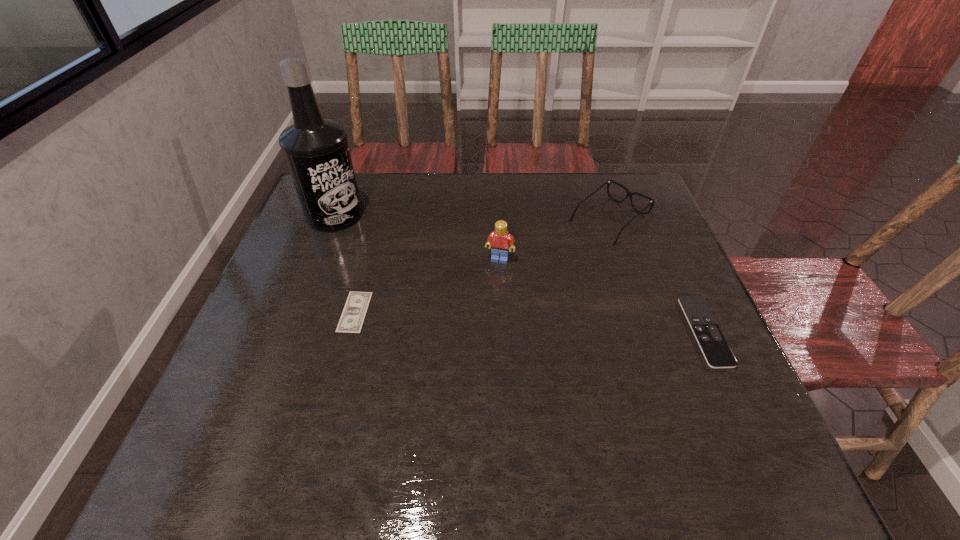
Locate an element on the screen. vacant region located with the lenses facing outward on the spectacles is located at coordinates (493, 307).

Locate an element on the screen. The height and width of the screenshot is (540, 960). vacant area situated with the lenses facing outward on the spectacles is located at coordinates (540, 273).

Find the location of a particular element. free space located with the lenses facing outward on the spectacles is located at coordinates (564, 254).

I want to click on vacant point located on the front label of the liquor, so click(x=400, y=253).

Where is `vacant space located on the front label of the liquor`? vacant space located on the front label of the liquor is located at coordinates (408, 258).

The image size is (960, 540). In order to click on vacant region located 0.050m on the front label of the liquor in this screenshot , I will do `click(366, 233)`.

Locate an element on the screen. The width and height of the screenshot is (960, 540). free space located on the front-facing side of the third object from left to right is located at coordinates (458, 390).

Locate an element on the screen. blank area located 0.400m on the front-facing side of the third object from left to right is located at coordinates (454, 404).

You are a GUI agent. You are given a task and a screenshot of the screen. Output one action in this format:
    pyautogui.click(x=<x>, y=<y>)
    Task: Click on the vacant position located 0.270m on the front-facing side of the third object from left to right
    The height and width of the screenshot is (540, 960).
    Given the screenshot: What is the action you would take?
    pyautogui.click(x=470, y=349)

Image resolution: width=960 pixels, height=540 pixels. Identify the location of spectacles that is at the far edge. (629, 194).